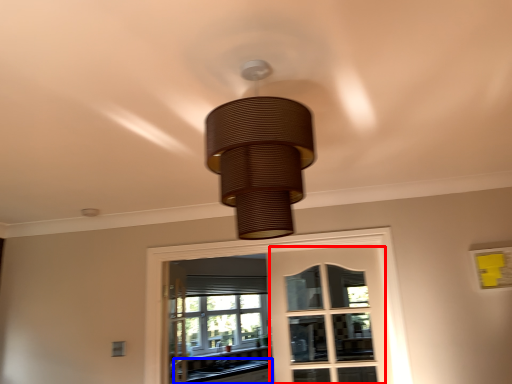
Question: Which point is further to the camera, screen door (highlighted by a red box) or counter top (highlighted by a blue box)?

Choices:
 (A) screen door
 (B) counter top

Answer: (B)